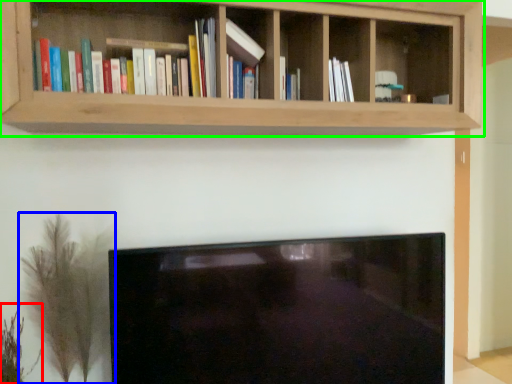
Question: Which object is positioned closest to plant (highlighted by a red box)? Select from plant (highlighted by a blue box) and shelf (highlighted by a green box).

Choices:
 (A) plant
 (B) shelf

Answer: (A)